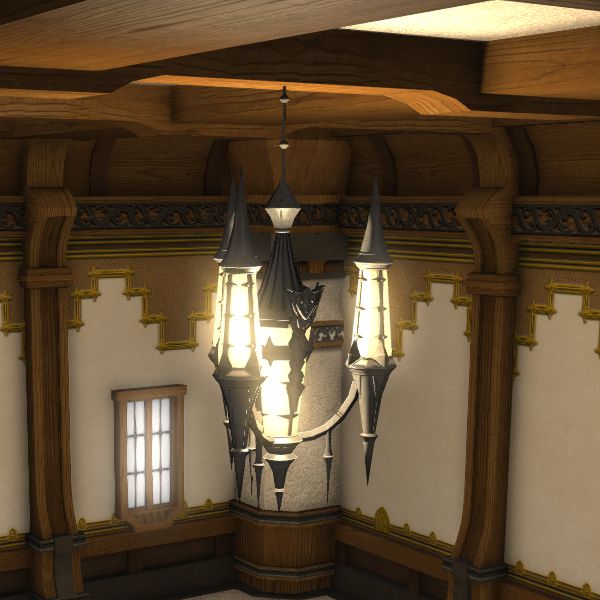
Locate an element on the screen. The image size is (600, 600). wall is located at coordinates (93, 365), (438, 420), (537, 434), (13, 400), (319, 391).